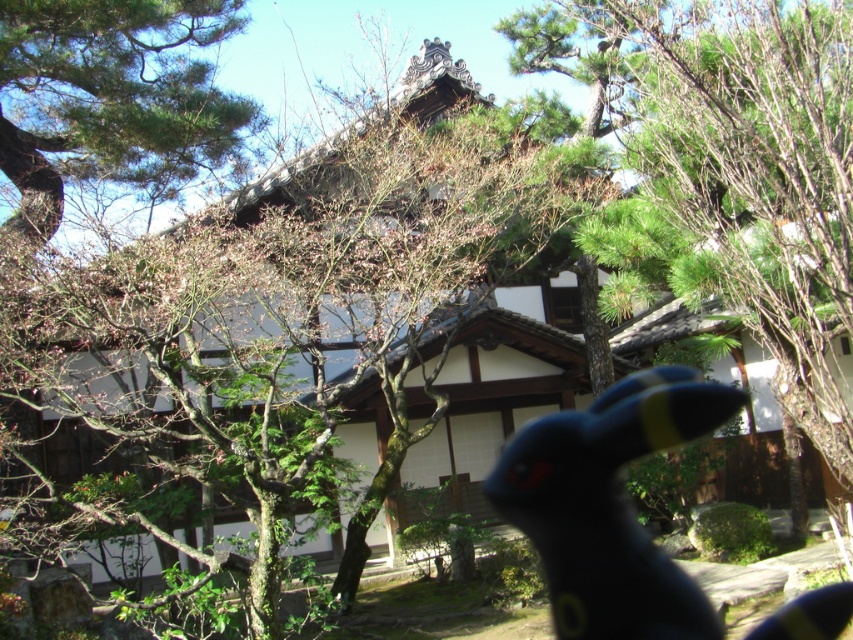
What do you see at coordinates (252, 262) in the screenshot?
I see `green leafy tree at center` at bounding box center [252, 262].

Who is positioned more to the left, green leafy tree at center or black rubber toy at center?

Positioned to the left is green leafy tree at center.

This screenshot has width=853, height=640. What are the coordinates of `green leafy tree at center` in the screenshot? It's located at (252, 262).

Is the position of green leafy tree at upper left less distant than that of black rubber toy at center?

No.

Can you confirm if green leafy tree at upper left is positioned to the left of black rubber toy at center?

Indeed, green leafy tree at upper left is positioned on the left side of black rubber toy at center.

Is point (10, 228) positioned in front of point (630, 380)?

Yes, it is.

Identify the location of green leafy tree at upper left. The width and height of the screenshot is (853, 640). (109, 97).

Between green leafy tree at center and green leafy tree at upper left, which one appears on the left side from the viewer's perspective?

From the viewer's perspective, green leafy tree at upper left appears more on the left side.

Is point (287, 244) closer to viewer compared to point (216, 42)?

Yes, it is.

Locate an element on the screen. This screenshot has width=853, height=640. green leafy tree at center is located at coordinates (252, 262).